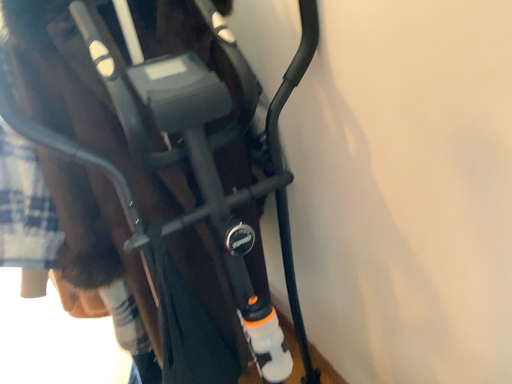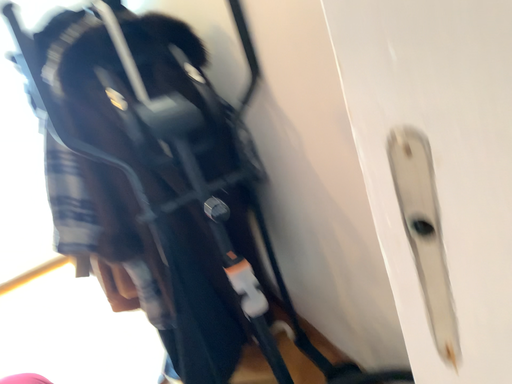
Question: How did the camera likely rotate when shooting the video?

Choices:
 (A) rotated left
 (B) rotated right

Answer: (A)